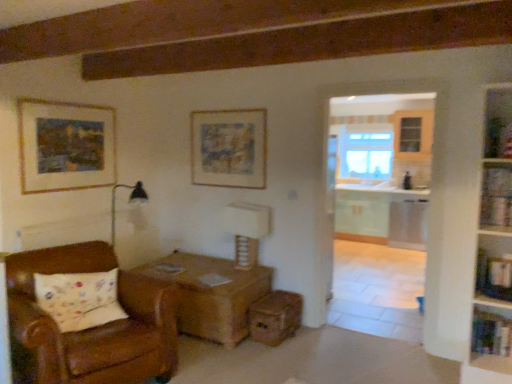
Locate an element on the screen. Image resolution: width=512 pixels, height=384 pixels. spots to the right of wooden drawer at lower center is located at coordinates (320, 341).